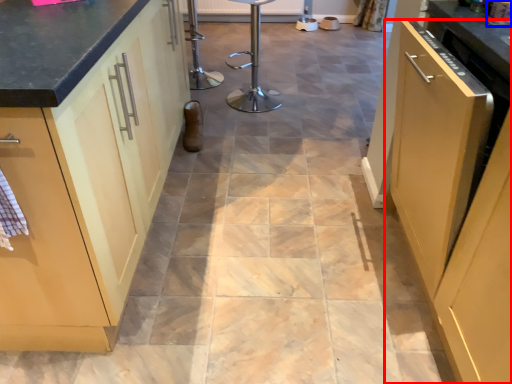
Question: Which object is further to the camera taking this photo, cabinetry (highlighted by a red box) or appliance (highlighted by a blue box)?

Choices:
 (A) cabinetry
 (B) appliance

Answer: (B)